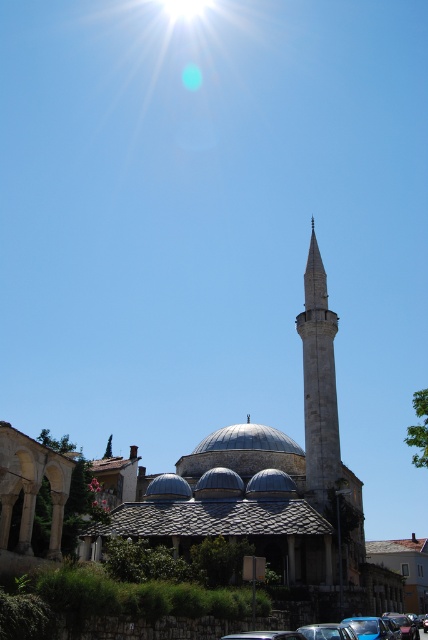
From the picture: You are standing in front of the mosque and want to take a photo that includes both the white stone minaret at center and the smooth gray dome at center. Based on their positions, which object will appear closer to the camera in the photo?

The white stone minaret at center is positioned over the smooth gray dome at center, so it will appear closer to the camera in the photo.

Looking at this image, you are a photographer planning to capture the mosque and the car in a single shot. Given that the smooth gray dome at center and the metallic silver car at center are both in your frame, which object will occupy more space in the photo?

The smooth gray dome at center will occupy more space in the photo because it is bigger than the metallic silver car at center according to the description.

You are standing at the point marked as point (386, 627) in the image. What object are you currently standing on?

You are standing on the metallic blue car at lower center.